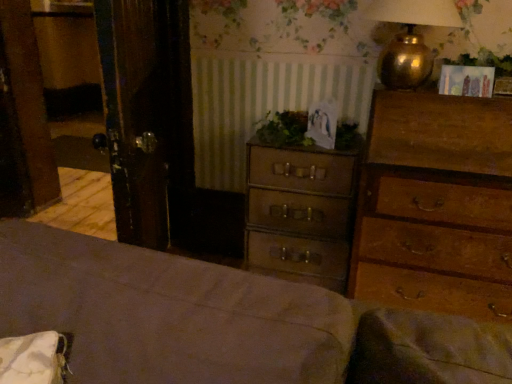
Locate an element on the screen. free point above brown leather suitcase at center, the second chest of drawers from the right (from a real-world perspective) is located at coordinates (295, 144).